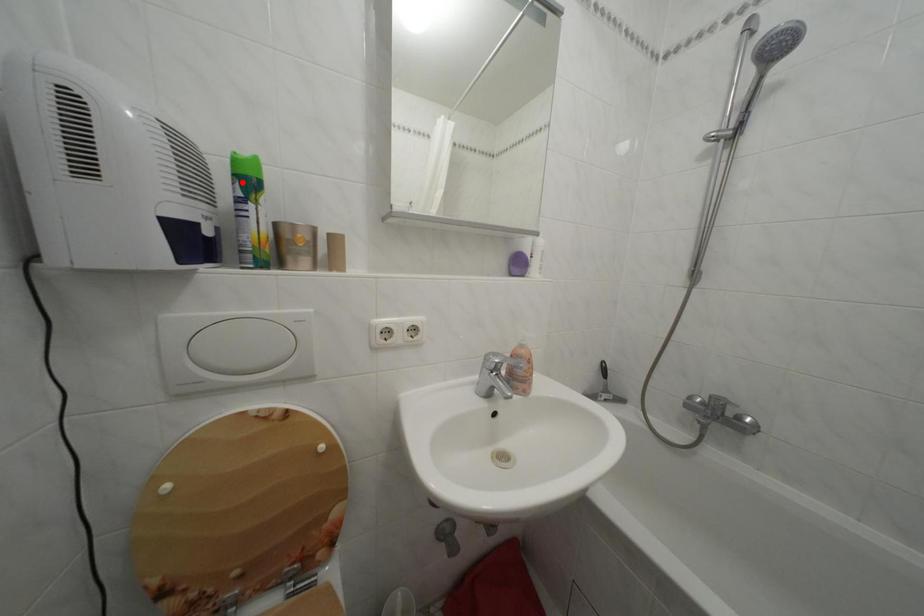
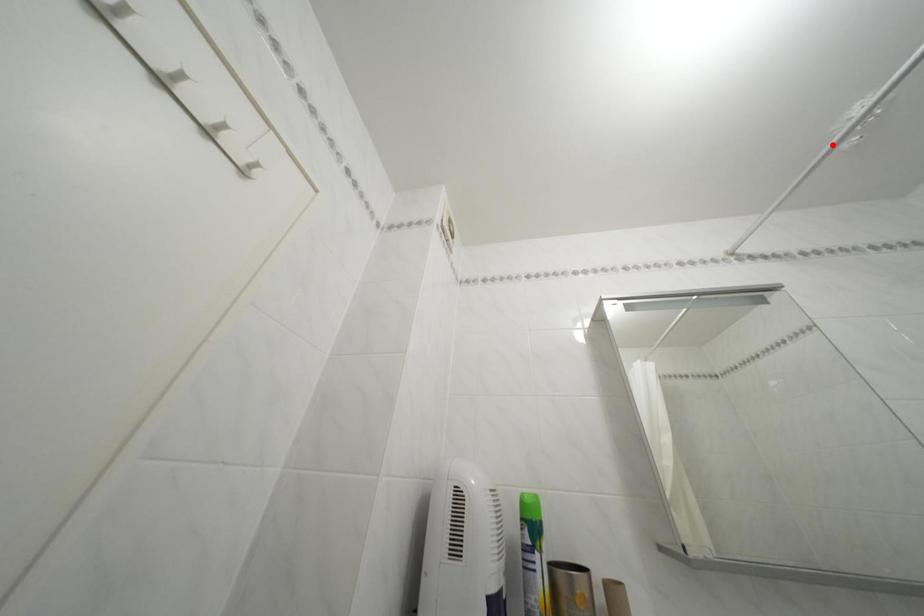
I am providing you with two images of the same scene from different viewpoints. A red point is marked on the first image and another point is marked on the second image. Does the point marked in image1 correspond to the same location as the one in image2?

No